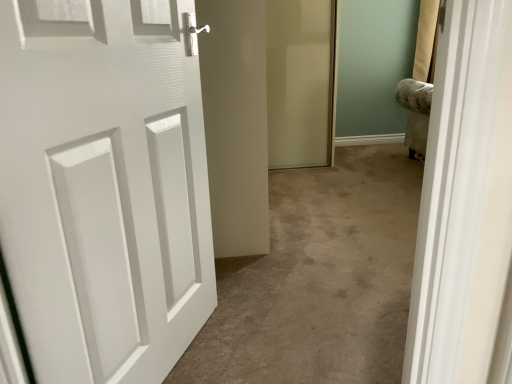
Question: Visually, is white matte door at left positioned to the left or to the right of translucent glass screen door at center?

Choices:
 (A) right
 (B) left

Answer: (B)

Question: Considering the positions of white matte door at left and translucent glass screen door at center in the image, is white matte door at left wider or thinner than translucent glass screen door at center?

Choices:
 (A) wide
 (B) thin

Answer: (B)

Question: Considering the positions of point (10, 28) and point (303, 84), is point (10, 28) closer or farther from the camera than point (303, 84)?

Choices:
 (A) farther
 (B) closer

Answer: (B)

Question: Which is correct: translucent glass screen door at center is inside white matte door at left, or outside of it?

Choices:
 (A) inside
 (B) outside

Answer: (B)

Question: Is translucent glass screen door at center bigger or smaller than white matte door at left?

Choices:
 (A) big
 (B) small

Answer: (A)

Question: Visually, is translucent glass screen door at center positioned to the left or to the right of white matte door at left?

Choices:
 (A) left
 (B) right

Answer: (B)

Question: Considering the positions of translucent glass screen door at center and white matte door at left in the image, is translucent glass screen door at center taller or shorter than white matte door at left?

Choices:
 (A) tall
 (B) short

Answer: (A)